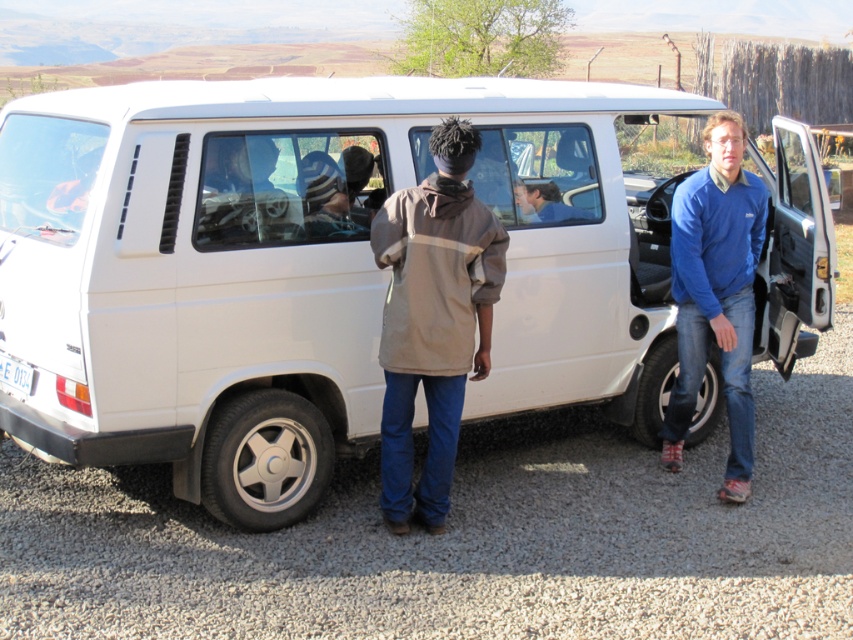
Question: Is white matte van at center further to the viewer compared to tan fabric jacket at center?

Choices:
 (A) yes
 (B) no

Answer: (B)

Question: Does white matte van at center have a smaller size compared to blue fleece jacket at right?

Choices:
 (A) no
 (B) yes

Answer: (A)

Question: Considering the real-world distances, which object is closest to the tan fabric jacket at center?

Choices:
 (A) blue fleece jacket at right
 (B) white matte van at center

Answer: (B)

Question: Is the position of tan fabric jacket at center more distant than that of blue fleece jacket at right?

Choices:
 (A) no
 (B) yes

Answer: (A)

Question: Which object is farther from the camera taking this photo?

Choices:
 (A) tan fabric jacket at center
 (B) white matte van at center
 (C) blue fleece jacket at right

Answer: (C)

Question: Which object is closer to the camera taking this photo?

Choices:
 (A) tan fabric jacket at center
 (B) white matte van at center
 (C) blue fleece jacket at right

Answer: (B)